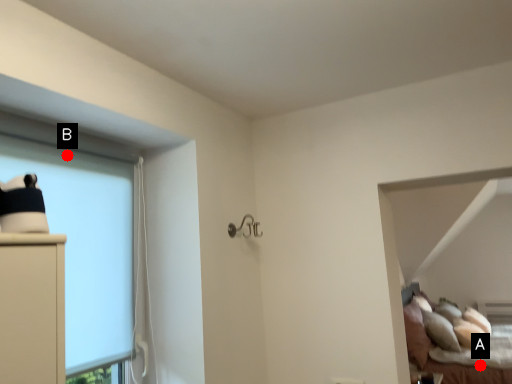
Question: Two points are circled on the image, labeled by A and B beside each circle. Which point is closer to the camera taking this photo?

Choices:
 (A) A is closer
 (B) B is closer

Answer: (B)